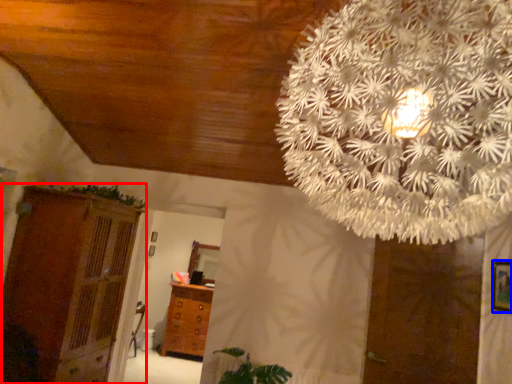
Question: Which of the following is the farthest to the observer, dresser (highlighted by a red box) or picture frame (highlighted by a blue box)?

Choices:
 (A) dresser
 (B) picture frame

Answer: (A)